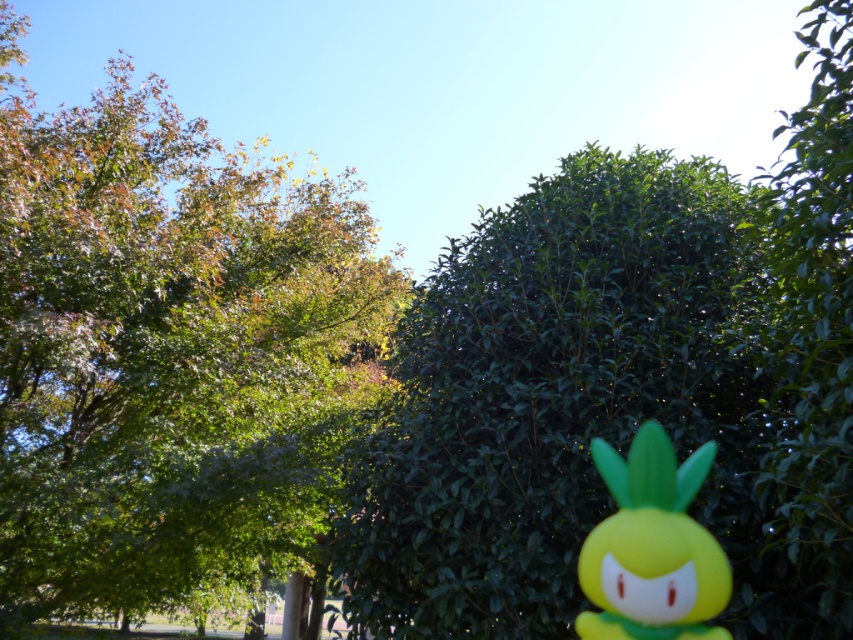
You are standing in the middle of the image and want to place a small yellow pineapple figurine at the exact center of the green leafy hedge at center. According to the coordinates provided, where should you place the figurine?

The green leafy hedge at center is located at coordinates point (561,401), so you should place the small yellow pineapple figurine at those coordinates to position it exactly at the center of the green leafy hedge at center.

You are a gardener planning to trim both the green leafy hedge at center and the green leafy tree at right. Based on their heights, which one will require a taller ladder?

The green leafy hedge at center is taller than the green leafy tree at right, so you will need a taller ladder for the green leafy hedge at center.

You are standing in the middle of the scene and want to take a photo of the green leafy tree at upper left and the green leafy tree at right. Which tree will appear smaller in the photo?

The green leafy tree at right is behind the green leafy tree at upper left, so it will appear smaller in the photo due to being further away.